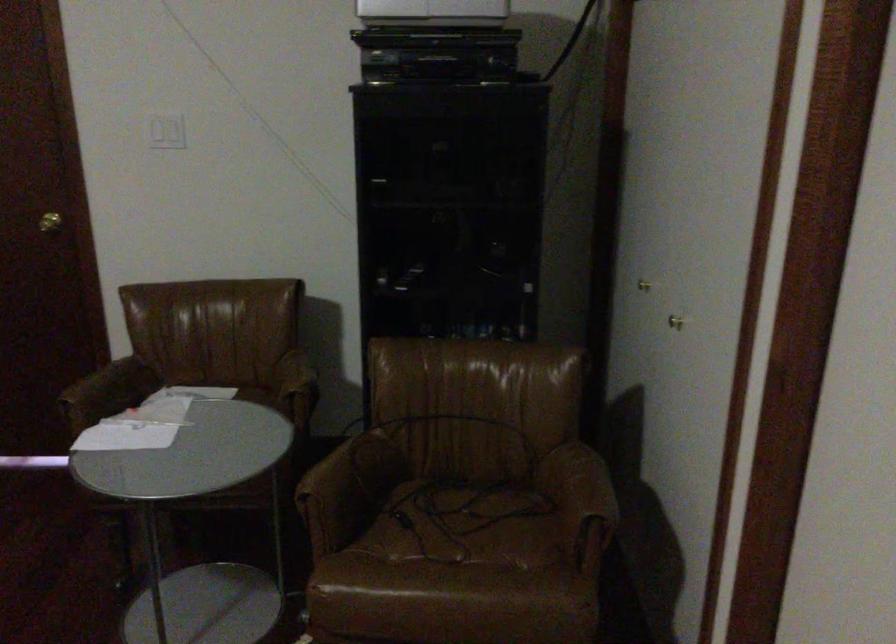
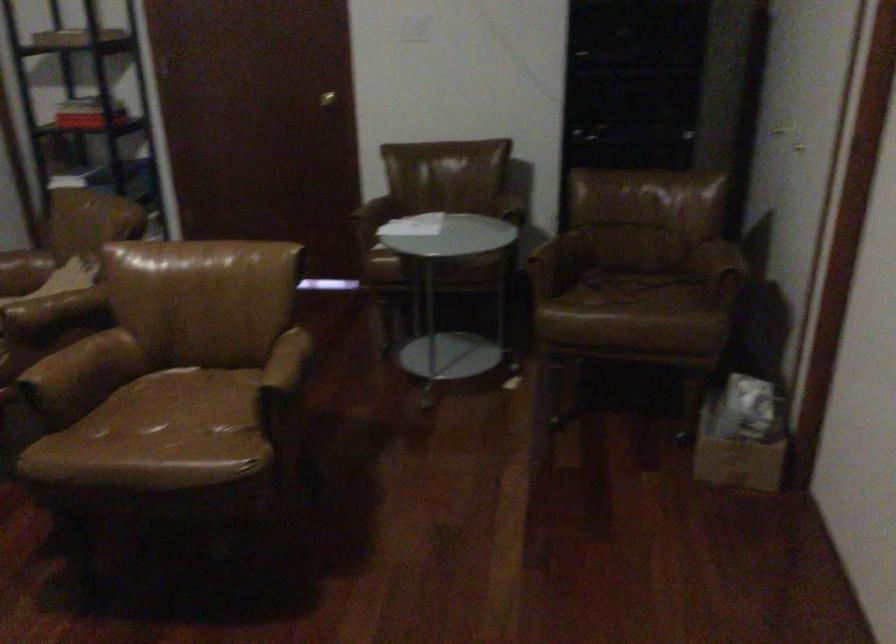
Where in the second image is the point corresponding to (454,527) from the first image?

(627, 288)